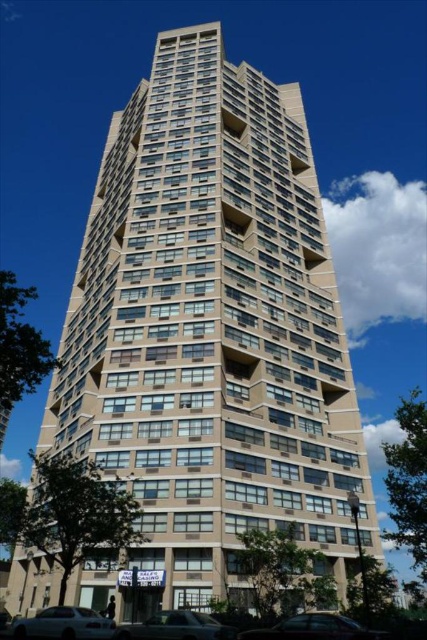
Question: Can you confirm if silver metallic sedan at lower left is smaller than silver metallic sedan at lower center?

Choices:
 (A) yes
 (B) no

Answer: (A)

Question: Which object is positioned farthest from the silver metallic sedan at lower center?

Choices:
 (A) silver metallic sedan at lower left
 (B) metallic silver car at lower center

Answer: (B)

Question: Does silver metallic sedan at lower center appear on the left side of metallic silver car at lower center?

Choices:
 (A) yes
 (B) no

Answer: (A)

Question: Which point appears closest to the camera in this image?

Choices:
 (A) (137, 637)
 (B) (99, 630)

Answer: (A)

Question: Can you confirm if silver metallic sedan at lower center is positioned to the right of metallic silver car at lower center?

Choices:
 (A) no
 (B) yes

Answer: (A)

Question: Estimate the real-world distances between objects in this image. Which object is closer to the silver metallic sedan at lower left?

Choices:
 (A) silver metallic sedan at lower center
 (B) metallic silver car at lower center

Answer: (A)